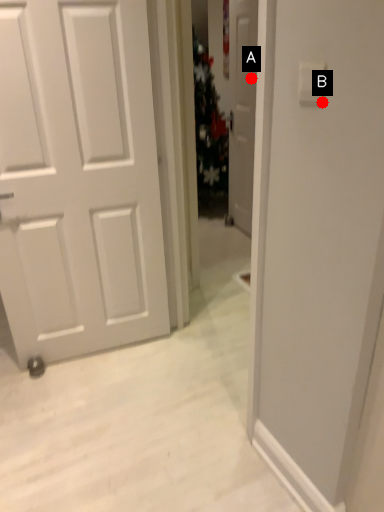
Question: Two points are circled on the image, labeled by A and B beside each circle. Which point is closer to the camera?

Choices:
 (A) A is closer
 (B) B is closer

Answer: (B)